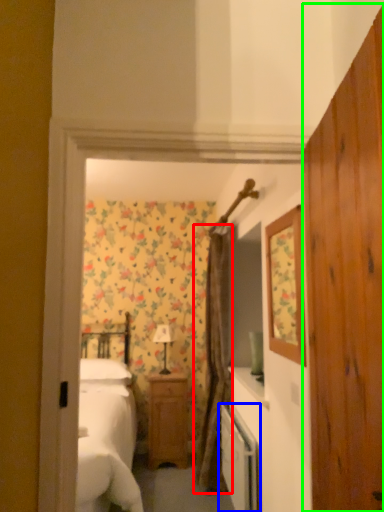
Question: Considering the real-world distances, which object is farthest from curtain (highlighted by a red box)? dish washer (highlighted by a blue box) or dresser (highlighted by a green box)?

Choices:
 (A) dish washer
 (B) dresser

Answer: (B)